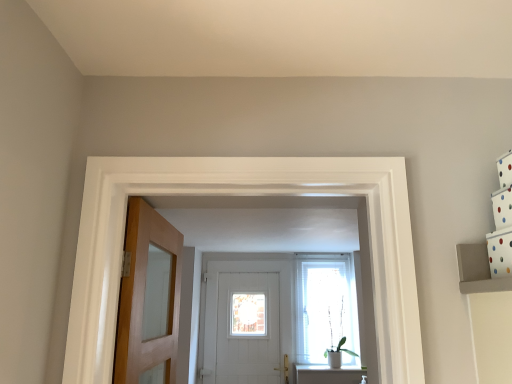
The width and height of the screenshot is (512, 384). In order to click on translucent fabric at center in this screenshot , I will do `click(325, 306)`.

The image size is (512, 384). Describe the element at coordinates (338, 342) in the screenshot. I see `green matte plant at center` at that location.

Locate an element on the screen. This screenshot has width=512, height=384. light brown wooden door at left, which is the 2th door from bottom to top is located at coordinates (148, 298).

Who is shorter, white wooden door at center, which is counted as the first door, starting from the bottom, or green matte plant at center?

With less height is green matte plant at center.

In terms of width, does white wooden door at center, marked as the 1th door in a back-to-front arrangement, look wider or thinner when compared to green matte plant at center?

white wooden door at center, marked as the 1th door in a back-to-front arrangement, is thinner than green matte plant at center.

Is white wooden door at center, which is counted as the first door, starting from the bottom, at the left side of green matte plant at center?

Indeed, white wooden door at center, which is counted as the first door, starting from the bottom, is positioned on the left side of green matte plant at center.

Is white wooden door at center, marked as the 1th door in a back-to-front arrangement, far from green matte plant at center?

No.

From the picture: From a real-world perspective, who is located lower, translucent fabric at center or white wooden door at center, arranged as the second door when viewed from the top?

white wooden door at center, arranged as the second door when viewed from the top, is physically lower.

From the image's perspective, between translucent fabric at center and white wooden door at center, marked as the 1th door in a back-to-front arrangement, which one is located above?

translucent fabric at center.

Based on the photo, is the depth of translucent fabric at center greater than that of white wooden door at center, which is counted as the first door, starting from the bottom?

Yes.

Which is more to the right, translucent fabric at center or white wooden door at center, arranged as the second door when viewed from the top?

From the viewer's perspective, translucent fabric at center appears more on the right side.

Based on the photo, is translucent fabric at center positioned far away from light brown wooden door at left, the 2th door from the back?

Yes, translucent fabric at center is far from light brown wooden door at left, the 2th door from the back.

From the image's perspective, would you say translucent fabric at center is positioned over light brown wooden door at left, the 1th door from the top?

Actually, translucent fabric at center appears below light brown wooden door at left, the 1th door from the top, in the image.

Considering the positions of objects translucent fabric at center and light brown wooden door at left, which is the 2th door from bottom to top, in the image provided, who is in front, translucent fabric at center or light brown wooden door at left, which is the 2th door from bottom to top,?

light brown wooden door at left, which is the 2th door from bottom to top, is closer to the camera.

Is point (316, 361) positioned after point (165, 278)?

Yes, point (316, 361) is behind point (165, 278).

From a real-world perspective, is white wooden door at center, marked as the 1th door in a back-to-front arrangement, above or below translucent fabric at center?

From a real-world perspective, white wooden door at center, marked as the 1th door in a back-to-front arrangement, is physically below translucent fabric at center.

Who is bigger, white wooden door at center, which is counted as the first door, starting from the bottom, or translucent fabric at center?

white wooden door at center, which is counted as the first door, starting from the bottom, is bigger.

Which object is further away from the camera, white wooden door at center, which is counted as the first door, starting from the bottom, or translucent fabric at center?

translucent fabric at center is more distant.

Is white wooden door at center, arranged as the second door when viewed from the top, facing away from translucent fabric at center?

No.

Which object is more forward, light brown wooden door at left, which is the 2th door from bottom to top, or green matte plant at center?

light brown wooden door at left, which is the 2th door from bottom to top.

Is light brown wooden door at left, the 2th door from the back, to the left of green matte plant at center from the viewer's perspective?

Yes, light brown wooden door at left, the 2th door from the back, is to the left of green matte plant at center.

Is light brown wooden door at left, the 2th door from the back, in contact with green matte plant at center?

light brown wooden door at left, the 2th door from the back, and green matte plant at center are clearly separated.

This screenshot has height=384, width=512. In order to click on door that is the 2nd object located above the green matte plant at center (from the image's perspective) in this screenshot , I will do `click(148, 298)`.

Considering the relative sizes of light brown wooden door at left, the 2th door from the back, and white wooden door at center, which is counted as the first door, starting from the bottom, in the image provided, is light brown wooden door at left, the 2th door from the back, thinner than white wooden door at center, which is counted as the first door, starting from the bottom,?

In fact, light brown wooden door at left, the 2th door from the back, might be wider than white wooden door at center, which is counted as the first door, starting from the bottom.

What's the angular difference between light brown wooden door at left, the 1th door from the top, and white wooden door at center, which is counted as the first door, starting from the bottom,'s facing directions?

The angular difference between light brown wooden door at left, the 1th door from the top, and white wooden door at center, which is counted as the first door, starting from the bottom, is 89 degrees.

Is light brown wooden door at left, acting as the first door starting from the front, directly adjacent to white wooden door at center, arranged as the second door when viewed from the top?

No, light brown wooden door at left, acting as the first door starting from the front, is not beside white wooden door at center, arranged as the second door when viewed from the top.

Is point (163, 383) closer or farther from the camera than point (230, 256)?

Clearly, point (163, 383) is closer to the camera than point (230, 256).

Can you confirm if green matte plant at center is shorter than translucent fabric at center?

Yes, green matte plant at center is shorter than translucent fabric at center.

From a real-world perspective, who is located lower, green matte plant at center or translucent fabric at center?

In real-world perspective, green matte plant at center is lower.

Is green matte plant at center placed right next to translucent fabric at center?

No, green matte plant at center is not next to translucent fabric at center.

Image resolution: width=512 pixels, height=384 pixels. Identify the location of plant located in front of the white wooden door at center, marked as the 1th door in a back-to-front arrangement. (338, 342).

Identify the location of door located underneath the translucent fabric at center (from a real-world perspective). The image size is (512, 384). (247, 271).

Estimate the real-world distances between objects in this image. Which object is further from translucent fabric at center, light brown wooden door at left, which is the 2th door from bottom to top, or green matte plant at center?

light brown wooden door at left, which is the 2th door from bottom to top, is further to translucent fabric at center.

From the image, which object appears to be farther from white wooden door at center, the 2th door viewed from the front, green matte plant at center or light brown wooden door at left, the 2th door from the back?

light brown wooden door at left, the 2th door from the back.

Based on their spatial positions, is light brown wooden door at left, the 1th door from the top, or translucent fabric at center further from white wooden door at center, arranged as the second door when viewed from the top?

light brown wooden door at left, the 1th door from the top.

Based on their spatial positions, is translucent fabric at center or light brown wooden door at left, the 2th door from the back, further from white wooden door at center, marked as the 1th door in a back-to-front arrangement?

light brown wooden door at left, the 2th door from the back.

Estimate the real-world distances between objects in this image. Which object is further from white wooden door at center, which is counted as the first door, starting from the bottom, green matte plant at center or translucent fabric at center?

green matte plant at center.

Estimate the real-world distances between objects in this image. Which object is closer to translucent fabric at center, white wooden door at center, marked as the 1th door in a back-to-front arrangement, or light brown wooden door at left, the 1th door from the top?

white wooden door at center, marked as the 1th door in a back-to-front arrangement, is closer to translucent fabric at center.

When comparing their distances from white wooden door at center, arranged as the second door when viewed from the top, does light brown wooden door at left, the 1th door from the top, or green matte plant at center seem closer?

green matte plant at center lies closer to white wooden door at center, arranged as the second door when viewed from the top, than the other object.

From the image, which object appears to be farther from green matte plant at center, white wooden door at center, arranged as the second door when viewed from the top, or translucent fabric at center?

Among the two, white wooden door at center, arranged as the second door when viewed from the top, is located further to green matte plant at center.

Where is `plant between light brown wooden door at left, acting as the first door starting from the front, and white wooden door at center, which is counted as the first door, starting from the bottom, from front to back`? The image size is (512, 384). plant between light brown wooden door at left, acting as the first door starting from the front, and white wooden door at center, which is counted as the first door, starting from the bottom, from front to back is located at coordinates (338, 342).

This screenshot has height=384, width=512. Identify the location of window between white wooden door at center, the 2th door viewed from the front, and green matte plant at center. (325, 306).

Find the location of `door between light brown wooden door at left, the 1th door from the top, and translucent fabric at center in the front-back direction`. door between light brown wooden door at left, the 1th door from the top, and translucent fabric at center in the front-back direction is located at coordinates (247, 271).

I want to click on plant between light brown wooden door at left, the 2th door from the back, and translucent fabric at center from front to back, so pyautogui.click(x=338, y=342).